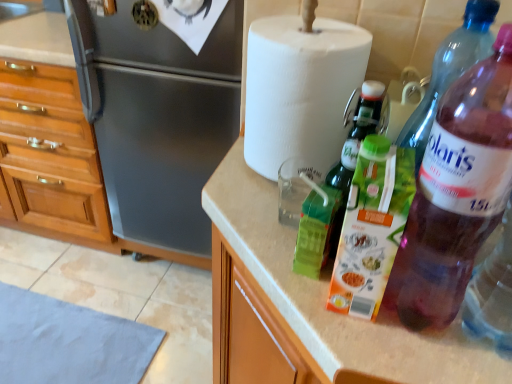
The height and width of the screenshot is (384, 512). Find the location of `translucent plastic bottle at right, the 1th bottle in the front-to-back sequence`. translucent plastic bottle at right, the 1th bottle in the front-to-back sequence is located at coordinates (456, 192).

Where is `white paper towel at upper center`? The image size is (512, 384). white paper towel at upper center is located at coordinates (300, 90).

This screenshot has height=384, width=512. I want to click on green matte carton at center, which appears as the second bottle when viewed from the front, so click(x=372, y=226).

How much distance is there between purple translucent bottle at right, which is counted as the first bottle, starting from the back, and beige laminate countertop at center?

purple translucent bottle at right, which is counted as the first bottle, starting from the back, is 11.99 inches away from beige laminate countertop at center.

Could you tell me if purple translucent bottle at right, the third bottle positioned from the front, is turned towards beige laminate countertop at center?

No, purple translucent bottle at right, the third bottle positioned from the front, is not facing towards beige laminate countertop at center.

Considering the relative positions of purple translucent bottle at right, which is counted as the first bottle, starting from the back, and beige laminate countertop at center in the image provided, is purple translucent bottle at right, which is counted as the first bottle, starting from the back, to the left of beige laminate countertop at center from the viewer's perspective?

No, purple translucent bottle at right, which is counted as the first bottle, starting from the back, is not to the left of beige laminate countertop at center.

Is the depth of purple translucent bottle at right, the third bottle positioned from the front, less than that of beige laminate countertop at center?

That is False.

Is white paper towel at upper center positioned with its back to green matte carton at center, placed as the second bottle when sorted from back to front?

No, green matte carton at center, placed as the second bottle when sorted from back to front, is not at the back of white paper towel at upper center.

Is white paper towel at upper center not within green matte carton at center, which appears as the second bottle when viewed from the front?

white paper towel at upper center is positioned outside green matte carton at center, which appears as the second bottle when viewed from the front.

Would you say white paper towel at upper center is to the left or to the right of green matte carton at center, placed as the second bottle when sorted from back to front, in the picture?

In the image, white paper towel at upper center appears on the left side of green matte carton at center, placed as the second bottle when sorted from back to front.

The width and height of the screenshot is (512, 384). Find the location of `bottle below the white paper towel at upper center (from a real-world perspective)`. bottle below the white paper towel at upper center (from a real-world perspective) is located at coordinates (372, 226).

From a real-world perspective, is translucent plastic bottle at right, placed as the 3th bottle when sorted from back to front, under brushed metal refrigerator at left?

No, from a real-world perspective, translucent plastic bottle at right, placed as the 3th bottle when sorted from back to front, is not beneath brushed metal refrigerator at left.

Between translucent plastic bottle at right, placed as the 3th bottle when sorted from back to front, and brushed metal refrigerator at left, which one is positioned behind?

brushed metal refrigerator at left is behind.

Considering the relative sizes of translucent plastic bottle at right, placed as the 3th bottle when sorted from back to front, and brushed metal refrigerator at left in the image provided, is translucent plastic bottle at right, placed as the 3th bottle when sorted from back to front, wider than brushed metal refrigerator at left?

In fact, translucent plastic bottle at right, placed as the 3th bottle when sorted from back to front, might be narrower than brushed metal refrigerator at left.

Is translucent plastic bottle at right, the 1th bottle in the front-to-back sequence, facing away from brushed metal refrigerator at left?

translucent plastic bottle at right, the 1th bottle in the front-to-back sequence, does not have its back to brushed metal refrigerator at left.

Is purple translucent bottle at right, which is counted as the first bottle, starting from the back, closer to the viewer compared to green matte carton at center, which appears as the second bottle when viewed from the front?

No, it is not.

This screenshot has width=512, height=384. I want to click on the 2nd bottle counting from the right of the green matte carton at center, placed as the second bottle when sorted from back to front, so click(450, 70).

Is point (430, 93) farther from viewer compared to point (379, 153)?

Yes, it is behind point (379, 153).

Considering the relative sizes of purple translucent bottle at right, the third bottle positioned from the front, and green matte carton at center, which appears as the second bottle when viewed from the front, in the image provided, is purple translucent bottle at right, the third bottle positioned from the front, bigger than green matte carton at center, which appears as the second bottle when viewed from the front,?

Correct, purple translucent bottle at right, the third bottle positioned from the front, is larger in size than green matte carton at center, which appears as the second bottle when viewed from the front.

Based on the photo, between purple translucent bottle at right, which is counted as the first bottle, starting from the back, and translucent plastic bottle at right, the 1th bottle in the front-to-back sequence, which one has less height?

purple translucent bottle at right, which is counted as the first bottle, starting from the back.

Would you say translucent plastic bottle at right, the 1th bottle in the front-to-back sequence, is part of purple translucent bottle at right, the third bottle positioned from the front,'s contents?

Actually, translucent plastic bottle at right, the 1th bottle in the front-to-back sequence, is outside purple translucent bottle at right, the third bottle positioned from the front.

The image size is (512, 384). I want to click on bottle that appears on the right of translucent plastic bottle at right, the 1th bottle in the front-to-back sequence, so click(450, 70).

Based on the photo, from the image's perspective, is purple translucent bottle at right, which is counted as the first bottle, starting from the back, under translucent plastic bottle at right, placed as the 3th bottle when sorted from back to front?

Actually, purple translucent bottle at right, which is counted as the first bottle, starting from the back, appears above translucent plastic bottle at right, placed as the 3th bottle when sorted from back to front, in the image.

Can you confirm if beige laminate countertop at center is positioned to the left of green matte carton at center, placed as the second bottle when sorted from back to front?

No.

Is beige laminate countertop at center smaller than green matte carton at center, placed as the second bottle when sorted from back to front?

Actually, beige laminate countertop at center might be larger than green matte carton at center, placed as the second bottle when sorted from back to front.

Is beige laminate countertop at center spatially inside green matte carton at center, placed as the second bottle when sorted from back to front, or outside of it?

beige laminate countertop at center cannot be found inside green matte carton at center, placed as the second bottle when sorted from back to front.

From the picture: Considering the positions of objects brushed metal refrigerator at left and green matte carton at center, which appears as the second bottle when viewed from the front, in the image provided, who is behind, brushed metal refrigerator at left or green matte carton at center, which appears as the second bottle when viewed from the front,?

Positioned behind is brushed metal refrigerator at left.

Based on the photo, from a real-world perspective, between brushed metal refrigerator at left and green matte carton at center, placed as the second bottle when sorted from back to front, who is vertically lower?

In real-world perspective, brushed metal refrigerator at left is lower.

Is brushed metal refrigerator at left taller or shorter than green matte carton at center, which appears as the second bottle when viewed from the front?

In the image, brushed metal refrigerator at left appears to be taller than green matte carton at center, which appears as the second bottle when viewed from the front.

Identify the location of the 2nd bottle to the right of the beige laminate countertop at center, starting your count from the anchor. (450, 70).

Identify the location of paper towel above the green matte carton at center, placed as the second bottle when sorted from back to front (from the image's perspective). (300, 90).

Estimate the real-world distances between objects in this image. Which object is further from purple translucent bottle at right, which is counted as the first bottle, starting from the back, green matte carton at center, placed as the second bottle when sorted from back to front, or translucent plastic bottle at right, the 1th bottle in the front-to-back sequence?

green matte carton at center, placed as the second bottle when sorted from back to front, lies further to purple translucent bottle at right, which is counted as the first bottle, starting from the back, than the other object.

Based on their spatial positions, is brushed metal refrigerator at left or green matte carton at center, which appears as the second bottle when viewed from the front, closer to white paper towel at upper center?

green matte carton at center, which appears as the second bottle when viewed from the front, is closer to white paper towel at upper center.

Considering their positions, is beige laminate countertop at center positioned further to white paper towel at upper center than purple translucent bottle at right, which is counted as the first bottle, starting from the back?

beige laminate countertop at center is positioned further to the anchor white paper towel at upper center.

Looking at the image, which one is located closer to brushed metal refrigerator at left, green matte carton at center, which appears as the second bottle when viewed from the front, or translucent plastic bottle at right, placed as the 3th bottle when sorted from back to front?

translucent plastic bottle at right, placed as the 3th bottle when sorted from back to front, is closer to brushed metal refrigerator at left.

Looking at the image, which one is located further to beige laminate countertop at center, brushed metal refrigerator at left or white paper towel at upper center?

brushed metal refrigerator at left is positioned further to the anchor beige laminate countertop at center.

Based on their spatial positions, is beige laminate countertop at center or brushed metal refrigerator at left further from translucent plastic bottle at right, placed as the 3th bottle when sorted from back to front?

The object further to translucent plastic bottle at right, placed as the 3th bottle when sorted from back to front, is brushed metal refrigerator at left.

Estimate the real-world distances between objects in this image. Which object is further from beige laminate countertop at center, green matte carton at center, which appears as the second bottle when viewed from the front, or white paper towel at upper center?

Based on the image, white paper towel at upper center appears to be further to beige laminate countertop at center.

Looking at the image, which one is located closer to white paper towel at upper center, brushed metal refrigerator at left or beige laminate countertop at center?

Based on the image, beige laminate countertop at center appears to be nearer to white paper towel at upper center.

Identify the location of countertop situated between brushed metal refrigerator at left and translucent plastic bottle at right, placed as the 3th bottle when sorted from back to front, from left to right. Image resolution: width=512 pixels, height=384 pixels. (327, 295).

At what (x,y) coordinates should I click in order to perform the action: click on countertop between translucent plastic bottle at right, placed as the 3th bottle when sorted from back to front, and purple translucent bottle at right, which is counted as the first bottle, starting from the back, in the front-back direction. Please return your answer as a coordinate pair (x, y). Looking at the image, I should click on (327, 295).

Locate an element on the screen. The height and width of the screenshot is (384, 512). paper towel between brushed metal refrigerator at left and beige laminate countertop at center in the horizontal direction is located at coordinates (300, 90).

Image resolution: width=512 pixels, height=384 pixels. In order to click on bottle between translucent plastic bottle at right, the 1th bottle in the front-to-back sequence, and purple translucent bottle at right, the third bottle positioned from the front, from front to back in this screenshot , I will do `click(372, 226)`.